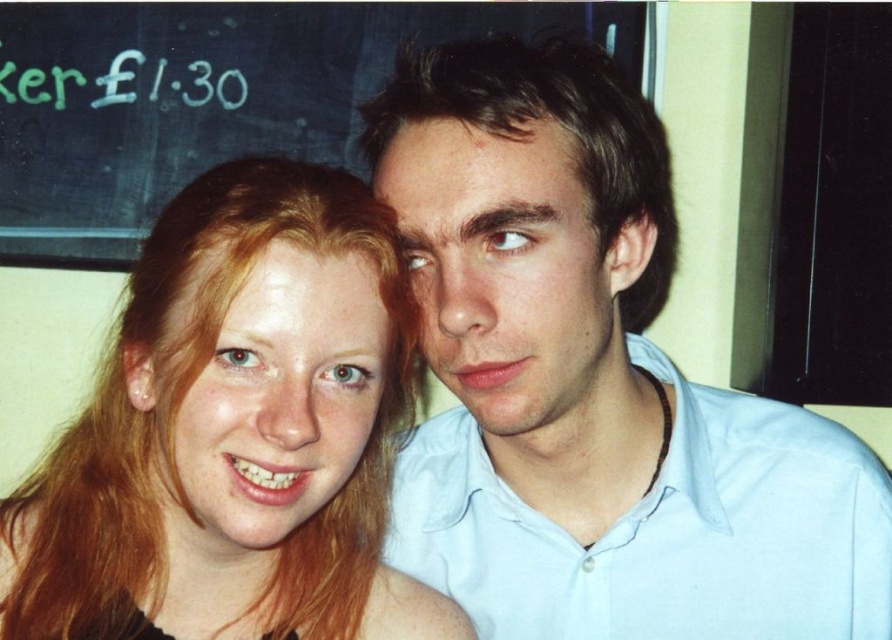
Question: Among these points, which one is farthest from the camera?

Choices:
 (A) (808, 604)
 (B) (244, 636)
 (C) (110, 202)
 (D) (618, 282)

Answer: (C)

Question: Based on their relative distances, which object is farther from the blonde hair at left?

Choices:
 (A) black chalkboard at upper left
 (B) light blue cotton shirt at right

Answer: (A)

Question: Does blonde hair at left have a larger size compared to black chalkboard at upper left?

Choices:
 (A) yes
 (B) no

Answer: (B)

Question: Estimate the real-world distances between objects in this image. Which object is farther from the blonde hair at left?

Choices:
 (A) black chalkboard at upper left
 (B) light blue shirt at center
 (C) light blue cotton shirt at right

Answer: (A)

Question: Does black chalkboard at upper left appear over dark brown smooth hair at upper center?

Choices:
 (A) yes
 (B) no

Answer: (A)

Question: Does blonde hair at left appear under light blue cotton shirt at right?

Choices:
 (A) no
 (B) yes

Answer: (A)